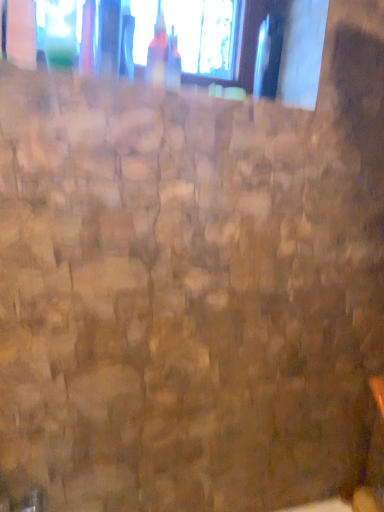
Question: From a real-world perspective, is transparent glass window at upper center beneath translucent glass bottle at upper center?

Choices:
 (A) no
 (B) yes

Answer: (A)

Question: Is transparent glass window at upper center not close to translucent glass bottle at upper center?

Choices:
 (A) no
 (B) yes

Answer: (A)

Question: Considering the relative positions of transparent glass window at upper center and translucent glass bottle at upper center in the image provided, is transparent glass window at upper center in front of translucent glass bottle at upper center?

Choices:
 (A) yes
 (B) no

Answer: (B)

Question: From a real-world perspective, is transparent glass window at upper center physically above translucent glass bottle at upper center?

Choices:
 (A) yes
 (B) no

Answer: (A)

Question: Does transparent glass window at upper center have a larger size compared to translucent glass bottle at upper center?

Choices:
 (A) yes
 (B) no

Answer: (A)

Question: Does transparent glass window at upper center lie behind translucent glass bottle at upper center?

Choices:
 (A) no
 (B) yes

Answer: (B)

Question: Is the position of translucent glass bottle at upper center more distant than that of transparent glass window at upper center?

Choices:
 (A) no
 (B) yes

Answer: (A)

Question: Is transparent glass window at upper center completely or partially inside translucent glass bottle at upper center?

Choices:
 (A) yes
 (B) no

Answer: (B)

Question: From a real-world perspective, does translucent glass bottle at upper center stand above transparent glass window at upper center?

Choices:
 (A) no
 (B) yes

Answer: (A)

Question: From the image's perspective, is translucent glass bottle at upper center under transparent glass window at upper center?

Choices:
 (A) no
 (B) yes

Answer: (B)

Question: Could you tell me if translucent glass bottle at upper center is turned towards transparent glass window at upper center?

Choices:
 (A) yes
 (B) no

Answer: (B)

Question: Can you confirm if translucent glass bottle at upper center is taller than transparent glass window at upper center?

Choices:
 (A) no
 (B) yes

Answer: (A)

Question: From their relative heights in the image, would you say translucent glass bottle at upper center is taller or shorter than transparent glass window at upper center?

Choices:
 (A) tall
 (B) short

Answer: (B)